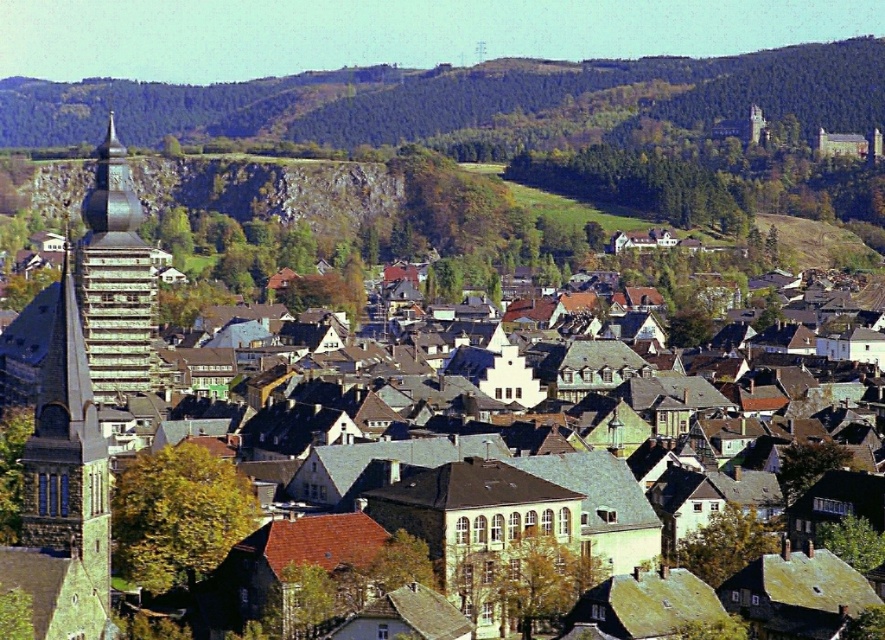
A hiker wants to travel from the church tower on the left to the green forested hill at upper center. The hiker can walk 100 feet per minute. How many minutes will it take to reach the hill?

The distance between the church tower on the left and the green forested hill at upper center is 1496.25 feet. At a walking pace of 100 feet per minute, the hiker will take 1496.25 divided by 100, which equals approximately 14.96 minutes. Rounded to the nearest whole number, it would take about 15 minutes.

You are standing at the point closer to the camera in the image. Which point are you standing at, point (722, 92) or point (122, 324)?

You are standing at point (122, 324) because it is closer to the camera than point (722, 92).